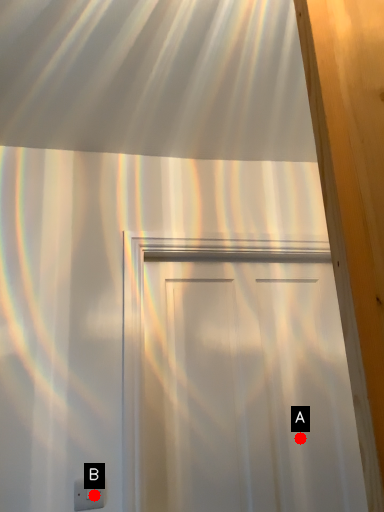
Question: Two points are circled on the image, labeled by A and B beside each circle. Among these points, which one is nearest to the camera?

Choices:
 (A) A is closer
 (B) B is closer

Answer: (B)